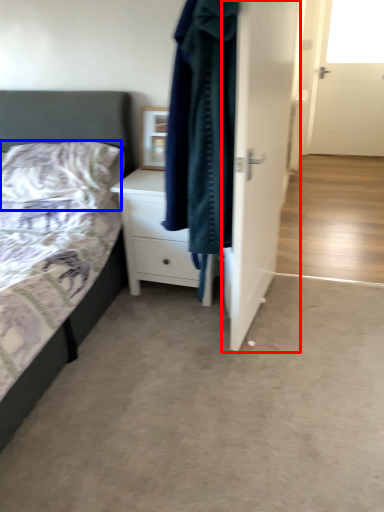
Question: Which point is closer to the camera, door (highlighted by a red box) or pillow (highlighted by a blue box)?

Choices:
 (A) door
 (B) pillow

Answer: (A)